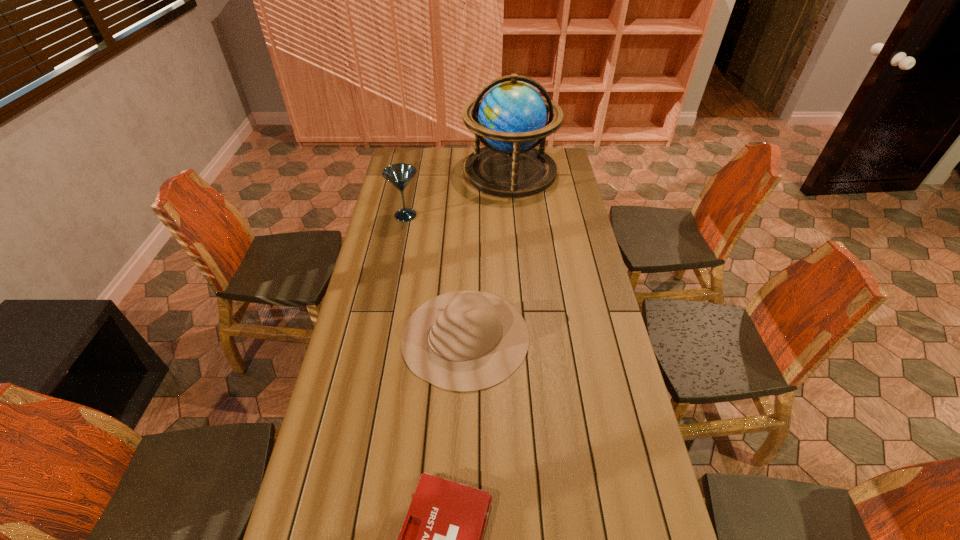
Where is `vacant point located between the second shortest object and the martini`? The image size is (960, 540). vacant point located between the second shortest object and the martini is located at coordinates (436, 276).

This screenshot has height=540, width=960. Find the location of `free space between the third farthest object and the farthest object`. free space between the third farthest object and the farthest object is located at coordinates (488, 254).

Find the location of a particular element. object that is the third closest to the second nearest object is located at coordinates (512, 116).

Identify the location of object that stands as the third closest to the first-aid kit. 512,116.

This screenshot has width=960, height=540. I want to click on blank area in the image that satisfies the following two spatial constraints: 1. on the back side of the second shortest object; 2. on the right side of the tallest object, so click(470, 171).

Find the location of a particular element. free space that satisfies the following two spatial constraints: 1. on the back side of the martini; 2. on the left side of the farthest object is located at coordinates 414,171.